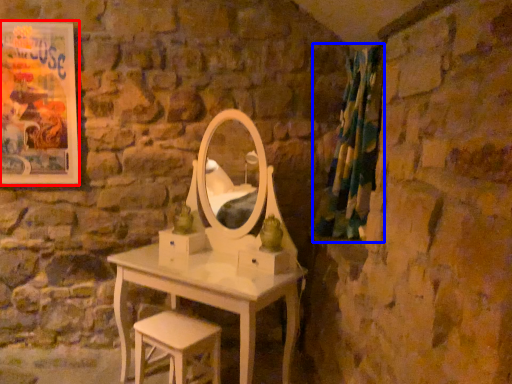
Question: Among these objects, which one is farthest to the camera, picture frame (highlighted by a red box) or curtain (highlighted by a blue box)?

Choices:
 (A) picture frame
 (B) curtain

Answer: (A)